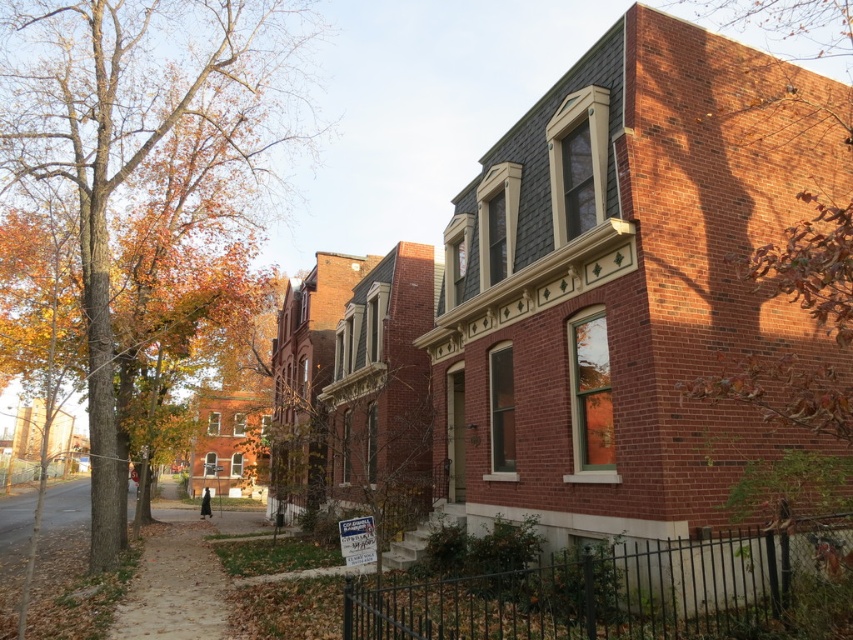
Between point (51, 161) and point (842, 196), which one is positioned in front?

Positioned in front is point (842, 196).

Is point (219, 51) positioned before point (814, 253)?

No, (219, 51) is behind (814, 253).

Is point (242, 134) positioned before point (741, 20)?

Yes, it is in front of point (741, 20).

Where is `autumn leaves at left`? This screenshot has width=853, height=640. autumn leaves at left is located at coordinates (125, 138).

Between brown leafy tree at right and brown dirt pavement at lower left, which one appears on the right side from the viewer's perspective?

brown leafy tree at right

Does brown leafy tree at right come in front of brown dirt pavement at lower left?

Yes, it is in front of brown dirt pavement at lower left.

Is point (722, 376) positioned in front of point (126, 625)?

Yes, it is.

The image size is (853, 640). In order to click on brown leafy tree at right in this screenshot , I will do `click(810, 317)`.

Between point (20, 72) and point (207, 564), which one is positioned behind?

Positioned behind is point (20, 72).

Is autumn leaves at left wider than brown dirt pavement at lower left?

No.

Locate an element on the screen. The height and width of the screenshot is (640, 853). autumn leaves at left is located at coordinates (125, 138).